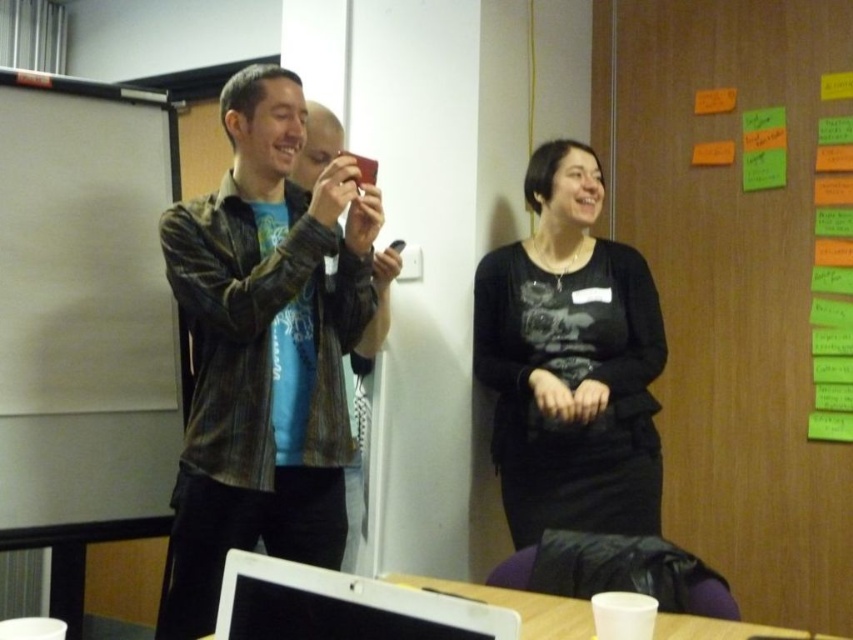
Question: Is the position of leather jacket at center less distant than that of white plastic cup at lower center?

Choices:
 (A) no
 (B) yes

Answer: (A)

Question: Which point is closer to the camera?

Choices:
 (A) white matte projector screen at left
 (B) black matte shirt at center

Answer: (A)

Question: Can you confirm if leather jacket at center is thinner than white matte projector screen at left?

Choices:
 (A) no
 (B) yes

Answer: (A)

Question: In this image, where is black matte shirt at center located relative to white glossy laptop at lower center?

Choices:
 (A) right
 (B) left

Answer: (A)

Question: Which object is the closest to the black matte shirt at center?

Choices:
 (A) white plastic cup at lower center
 (B) white matte projector screen at left

Answer: (A)

Question: Among these objects, which one is nearest to the camera?

Choices:
 (A) leather jacket at center
 (B) white plastic cup at lower center

Answer: (B)